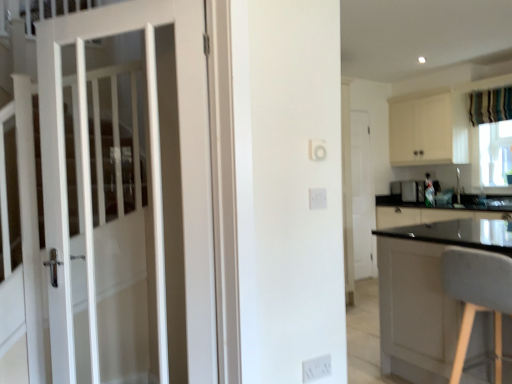
The width and height of the screenshot is (512, 384). What do you see at coordinates (180, 155) in the screenshot?
I see `white wooden door at left, the 2th door when ordered from back to front` at bounding box center [180, 155].

This screenshot has height=384, width=512. Identify the location of metallic silver toaster at right. (411, 190).

From a real-world perspective, which object stands above the other?

In real-world perspective, white matte door at center, the 2th door positioned from the left, is above.

Looking at this image, from the image's perspective, which is above, white plastic electric outlet at lower center or white matte door at center, the 2th door positioned from the left?

white matte door at center, the 2th door positioned from the left.

Which of these two, white plastic electric outlet at lower center or white matte door at center, arranged as the 1th door when viewed from the back, stands shorter?

Standing shorter between the two is white plastic electric outlet at lower center.

Choose the correct answer: Is white plastic electric outlet at lower center inside white matte door at center, marked as the 2th door in a front-to-back arrangement, or outside it?

white plastic electric outlet at lower center is spatially situated outside white matte door at center, marked as the 2th door in a front-to-back arrangement.

From the picture: Which of these two, white wooden door at left, which is counted as the second door, starting from the right, or white matte door at center, the 2th door positioned from the left, stands taller?

Standing taller between the two is white matte door at center, the 2th door positioned from the left.

How different are the orientations of white wooden door at left, which is counted as the second door, starting from the right, and white matte door at center, the 1th door viewed from the right, in degrees?

55.1 degrees.

Would you consider white wooden door at left, the 1th door in the left-to-right sequence, to be distant from white matte door at center, the 2th door positioned from the left?

Yes, white wooden door at left, the 1th door in the left-to-right sequence, and white matte door at center, the 2th door positioned from the left, are located far from each other.

Locate an element on the screen. door below the white wooden door at left, the 2th door when ordered from back to front (from a real-world perspective) is located at coordinates (361, 194).

How different are the orientations of white wooden door at left, the 2th door when ordered from back to front, and metallic silver toaster at right in degrees?

The facing directions of white wooden door at left, the 2th door when ordered from back to front, and metallic silver toaster at right are 35.7 degrees apart.

From the image's perspective, would you say white wooden door at left, which is counted as the second door, starting from the right, is shown under metallic silver toaster at right?

Yes.

How much distance is there between white wooden door at left, the 1th door in the left-to-right sequence, and metallic silver toaster at right?

white wooden door at left, the 1th door in the left-to-right sequence, and metallic silver toaster at right are 4.12 meters apart.

Looking at this image, in the image, is white wooden door at left, the 2th door when ordered from back to front, positioned in front of or behind metallic silver toaster at right?

white wooden door at left, the 2th door when ordered from back to front, is in front of metallic silver toaster at right.

Considering the sizes of objects white wooden door at left, which is counted as the second door, starting from the right, and gray fabric chair at right in the image provided, who is wider, white wooden door at left, which is counted as the second door, starting from the right, or gray fabric chair at right?

gray fabric chair at right is wider.

Looking at the image, does white wooden door at left, which is counted as the second door, starting from the right, seem bigger or smaller compared to gray fabric chair at right?

Considering their sizes, white wooden door at left, which is counted as the second door, starting from the right, takes up less space than gray fabric chair at right.

From the picture: How many degrees apart are the facing directions of white wooden door at left, which is counted as the 1th door, starting from the front, and gray fabric chair at right?

The angular difference between white wooden door at left, which is counted as the 1th door, starting from the front, and gray fabric chair at right is 142 degrees.

From the picture: From a real-world perspective, which is physically below, white wooden door at left, which is counted as the 1th door, starting from the front, or gray fabric chair at right?

gray fabric chair at right.

Is point (479, 109) closer or farther from the camera than point (503, 271)?

Point (479, 109) is positioned farther from the camera compared to point (503, 271).

Is striped fabric curtain at upper right inside the boundaries of gray fabric chair at right, or outside?

striped fabric curtain at upper right lies outside gray fabric chair at right.

Is striped fabric curtain at upper right oriented away from gray fabric chair at right?

No, gray fabric chair at right is not at the back of striped fabric curtain at upper right.

Which object is closer to the camera taking this photo, striped fabric curtain at upper right or gray fabric chair at right?

Positioned in front is gray fabric chair at right.

From a real-world perspective, is white plastic electric outlet at lower center below transparent plastic window screen at right?

Yes, from a real-world perspective, white plastic electric outlet at lower center is beneath transparent plastic window screen at right.

Looking at this image, is white plastic electric outlet at lower center not within transparent plastic window screen at right?

Yes, white plastic electric outlet at lower center is located beyond the bounds of transparent plastic window screen at right.

Based on the photo, is white plastic electric outlet at lower center wider than transparent plastic window screen at right?

Incorrect, the width of white plastic electric outlet at lower center does not surpass that of transparent plastic window screen at right.

From the image's perspective, is white plastic electric outlet at lower center below transparent plastic window screen at right?

Indeed, from the image's perspective, white plastic electric outlet at lower center is shown beneath transparent plastic window screen at right.

Is transparent plastic window screen at right at the right side of metallic silver toaster at right?

Correct, you'll find transparent plastic window screen at right to the right of metallic silver toaster at right.

From the image's perspective, between transparent plastic window screen at right and metallic silver toaster at right, who is located below?

From the image's view, metallic silver toaster at right is below.

Considering the points (484, 148) and (416, 186), which point is behind, point (484, 148) or point (416, 186)?

The point (416, 186) is behind.

Can you tell me how much transparent plastic window screen at right and metallic silver toaster at right differ in facing direction?

2.27 degrees.

This screenshot has height=384, width=512. I want to click on electric outlet that appears below the white matte door at center, marked as the 2th door in a front-to-back arrangement (from the image's perspective), so click(316, 368).

This screenshot has height=384, width=512. I want to click on door above the white wooden door at left, which is counted as the 1th door, starting from the front (from the image's perspective), so click(x=361, y=194).

Which object lies further to the anchor point metallic silver toaster at right, transparent plastic window screen at right or white wooden door at left, the 1th door in the left-to-right sequence?

white wooden door at left, the 1th door in the left-to-right sequence, is further to metallic silver toaster at right.

Looking at this image, considering their positions, is gray fabric chair at right positioned closer to metallic silver toaster at right than striped fabric curtain at upper right?

striped fabric curtain at upper right is closer to metallic silver toaster at right.

In the scene shown: When comparing their distances from white wooden door at left, which is counted as the second door, starting from the right, does transparent plastic window screen at right or white matte door at center, marked as the 2th door in a front-to-back arrangement, seem closer?

Among the two, white matte door at center, marked as the 2th door in a front-to-back arrangement, is located nearer to white wooden door at left, which is counted as the second door, starting from the right.

When comparing their distances from gray fabric chair at right, does metallic silver toaster at right or transparent plastic window screen at right seem further?

Among the two, metallic silver toaster at right is located further to gray fabric chair at right.

From the image, which object appears to be farther from white matte door at center, arranged as the 1th door when viewed from the back, white wooden door at left, the 1th door in the left-to-right sequence, or gray fabric chair at right?

Based on the image, white wooden door at left, the 1th door in the left-to-right sequence, appears to be further to white matte door at center, arranged as the 1th door when viewed from the back.

When comparing their distances from white plastic electric outlet at lower center, does striped fabric curtain at upper right or metallic silver toaster at right seem further?

The object further to white plastic electric outlet at lower center is metallic silver toaster at right.

From the image, which object appears to be nearer to white plastic electric outlet at lower center, striped fabric curtain at upper right or transparent plastic window screen at right?

transparent plastic window screen at right is positioned closer to the anchor white plastic electric outlet at lower center.

Based on their spatial positions, is white plastic electric outlet at lower center or transparent plastic window screen at right further from gray fabric chair at right?

The object further to gray fabric chair at right is transparent plastic window screen at right.

Image resolution: width=512 pixels, height=384 pixels. I want to click on curtain between gray fabric chair at right and metallic silver toaster at right from front to back, so click(490, 105).

Identify the location of electric outlet between gray fabric chair at right and white matte door at center, arranged as the 1th door when viewed from the back, along the z-axis. (316, 368).

Locate an element on the screen. curtain between white plastic electric outlet at lower center and white matte door at center, the 1th door viewed from the right, along the z-axis is located at coordinates (490, 105).

The width and height of the screenshot is (512, 384). Identify the location of electric outlet between gray fabric chair at right and transparent plastic window screen at right in the front-back direction. (316, 368).